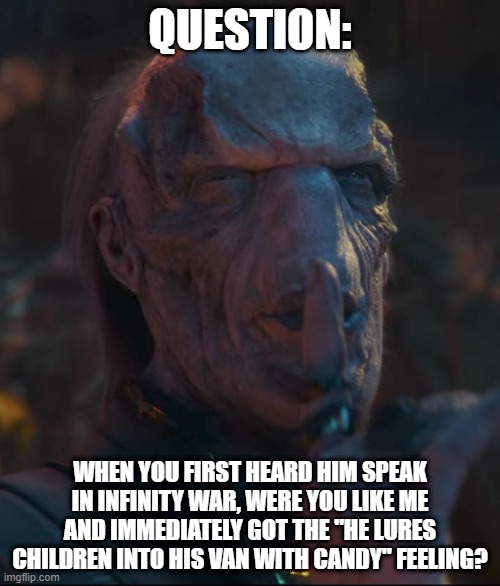
The height and width of the screenshot is (586, 500). In order to click on wall in this screenshot , I will do `click(459, 138)`, `click(44, 177)`.